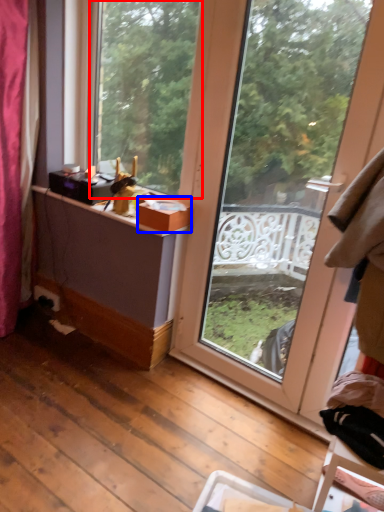
Question: Which object is closer to the camera taking this photo, window (highlighted by a red box) or box (highlighted by a blue box)?

Choices:
 (A) window
 (B) box

Answer: (A)